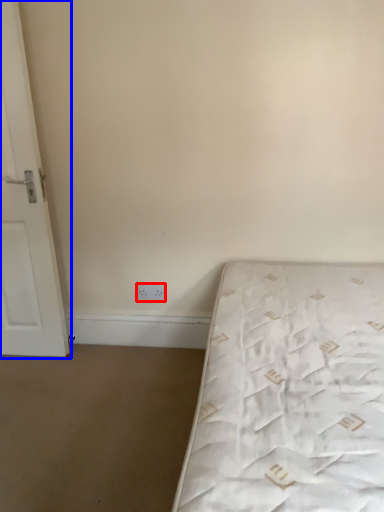
Question: Which point is further to the camera, electric outlet (highlighted by a red box) or door (highlighted by a blue box)?

Choices:
 (A) electric outlet
 (B) door

Answer: (A)